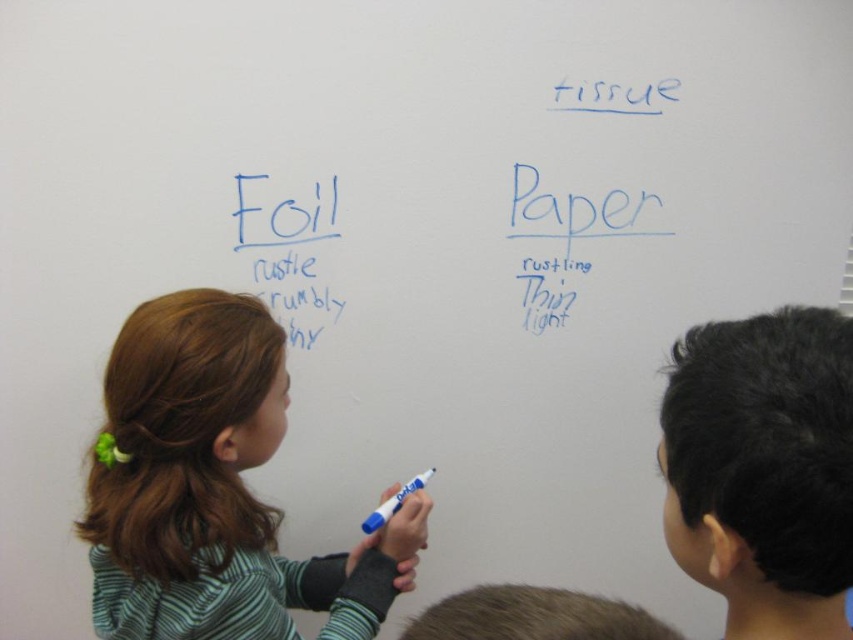
You are a teacher observing the scene. You need to hand out a worksheet to the child wearing the green striped shirt at center left and the child with black hair at upper right. Which child should you approach first to give the worksheet?

You should approach the child wearing the green striped shirt at center left first because they are closer to you than the child with black hair at upper right, who is further away.

You are standing in front of the whiteboard and want to hand a marker to the child wearing the green striped shirt at center left. Where should you look to find them?

The green striped shirt at center left is located at the 2D coordinates point (213,488), so you should look towards that point to find them.